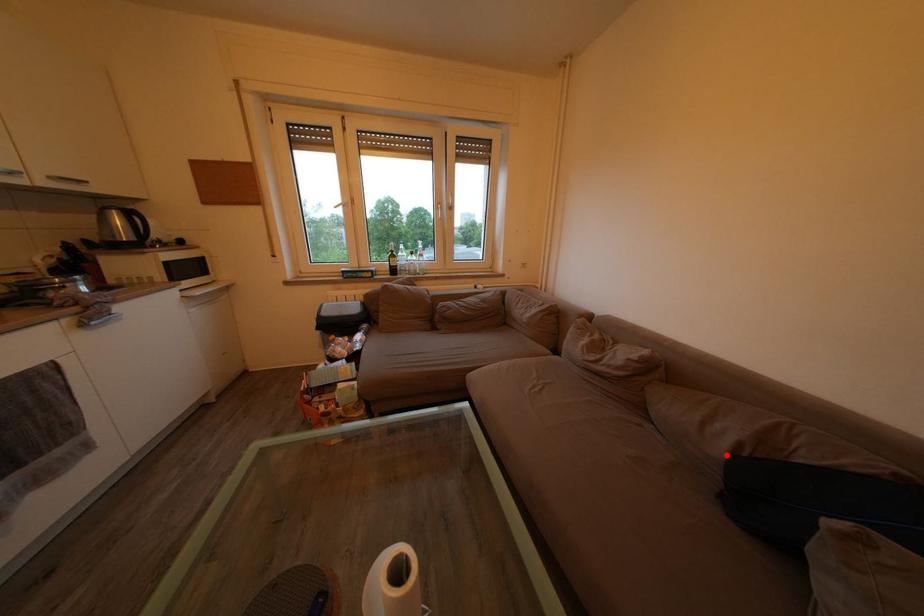
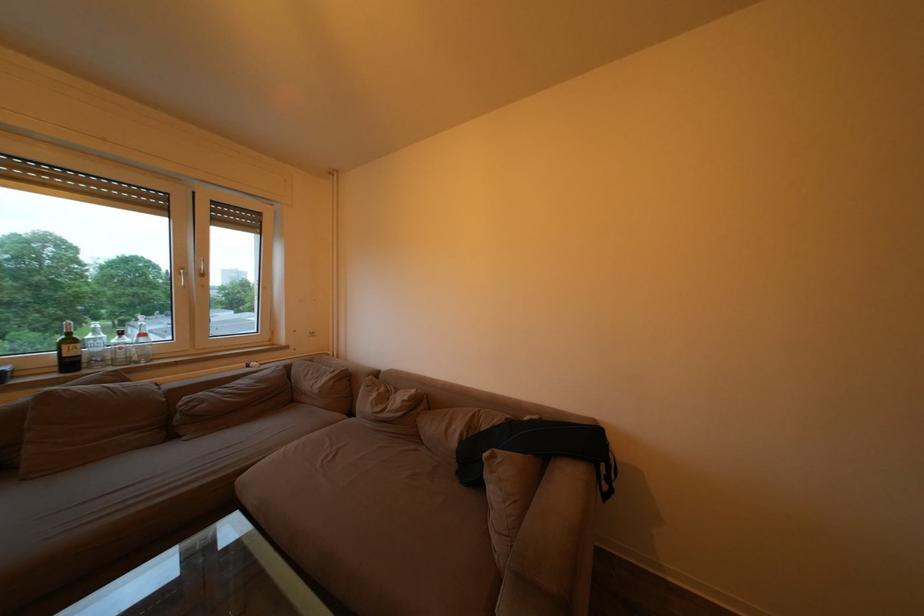
The point at the highlighted location is marked in the first image. Where is the corresponding point in the second image?

(463, 448)